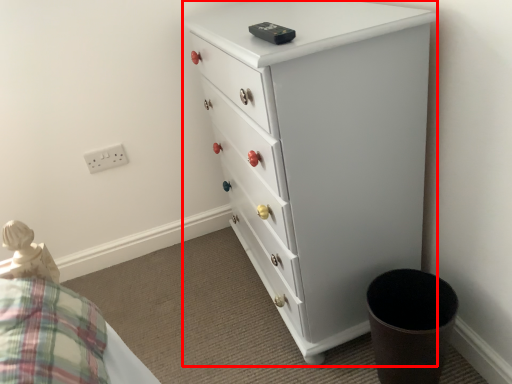
Question: From the image's perspective, where is chest of drawers (annotated by the red box) located relative to electric outlet?

Choices:
 (A) below
 (B) above

Answer: (A)